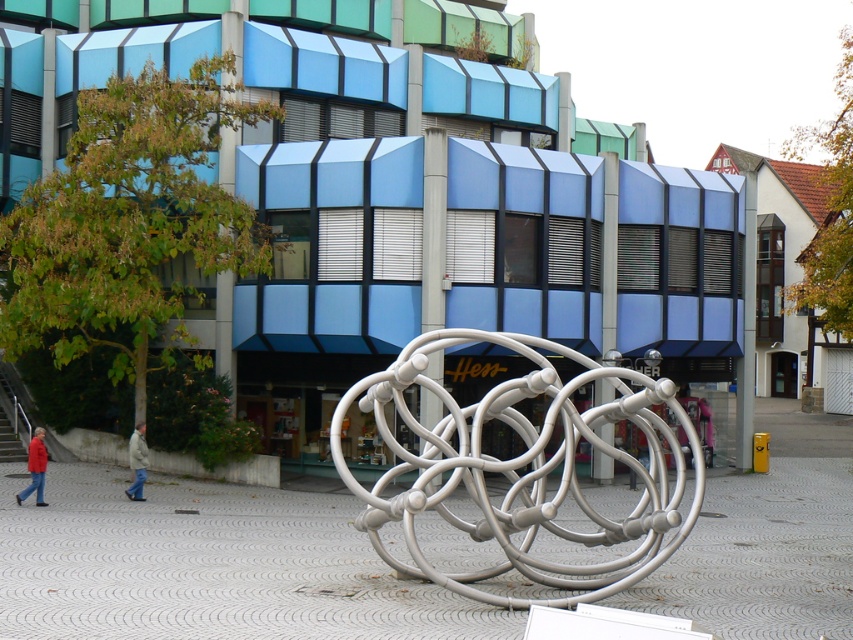
Question: Does red jacket at lower left appear over light beige jacket at lower left?

Choices:
 (A) no
 (B) yes

Answer: (B)

Question: Does white metallic sculpture at center have a lesser width compared to red jacket at lower left?

Choices:
 (A) no
 (B) yes

Answer: (A)

Question: Estimate the real-world distances between objects in this image. Which object is closer to the light beige jacket at lower left?

Choices:
 (A) red jacket at lower left
 (B) white metallic sculpture at center

Answer: (A)

Question: Which of these objects is positioned farthest from the red jacket at lower left?

Choices:
 (A) light beige jacket at lower left
 (B) white metallic sculpture at center

Answer: (B)

Question: Is red jacket at lower left smaller than light beige jacket at lower left?

Choices:
 (A) no
 (B) yes

Answer: (B)

Question: Among these objects, which one is farthest from the camera?

Choices:
 (A) red jacket at lower left
 (B) white metallic sculpture at center
 (C) light beige jacket at lower left

Answer: (C)